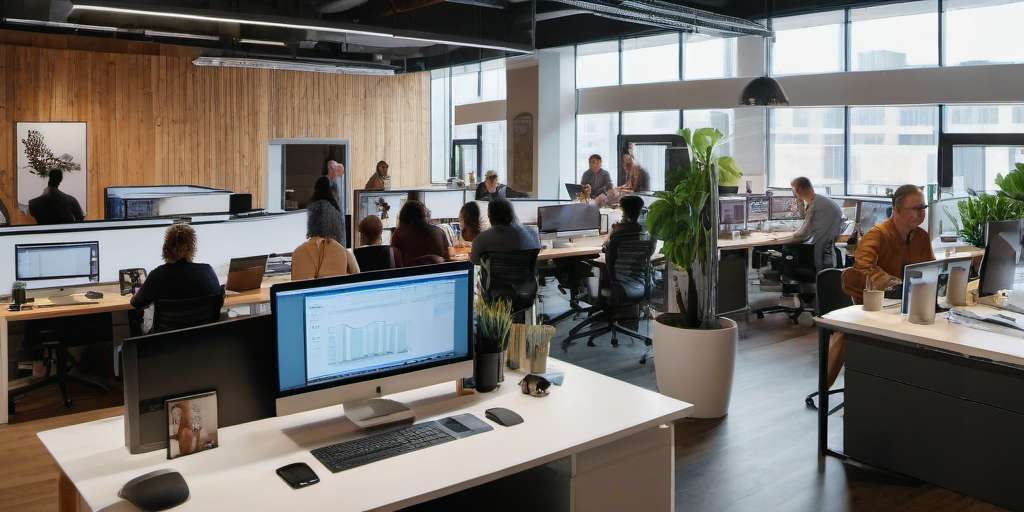
Find the location of `monitor`. monitor is located at coordinates (354, 334), (72, 256), (392, 205), (447, 200), (585, 215), (759, 212), (779, 209), (878, 211), (939, 272), (573, 184).